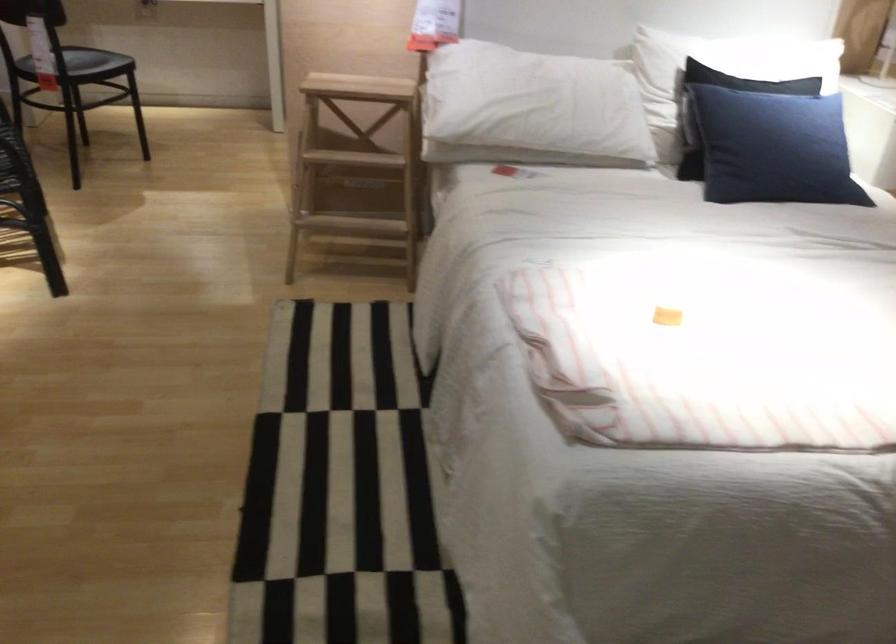
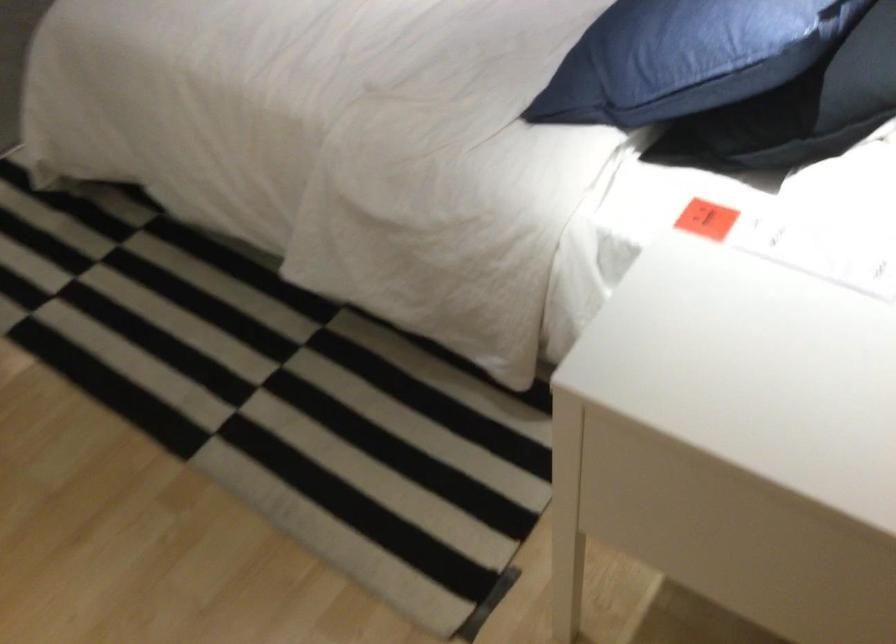
Where in the second image is the point corresponding to [821,117] from the first image?

(808, 108)